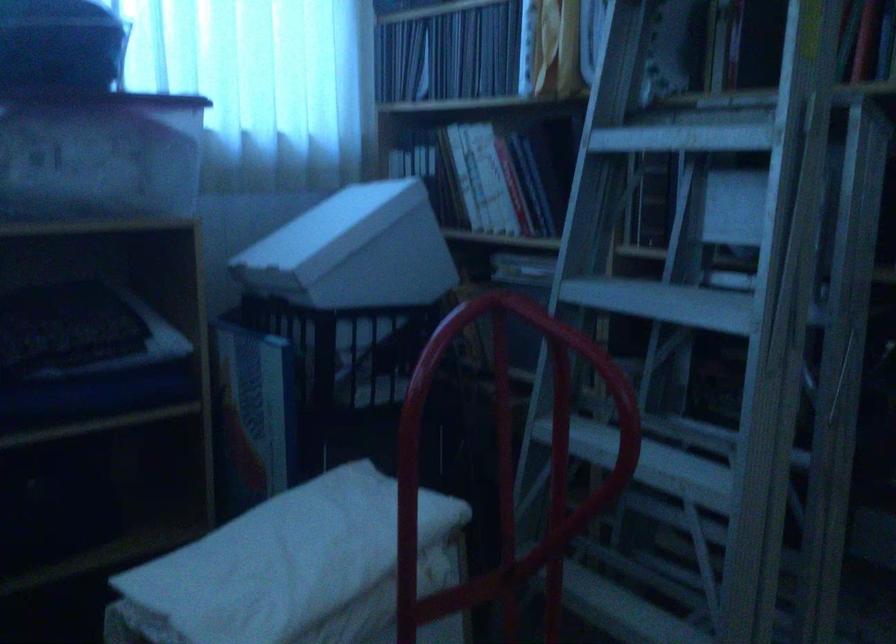
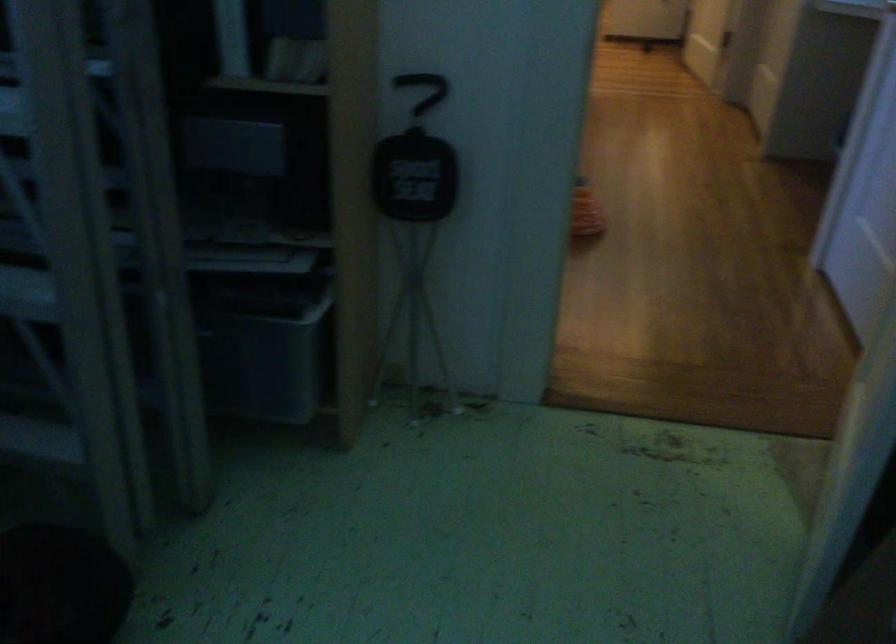
Looking at this image, how did the camera likely rotate?

The camera rotated toward right-down.